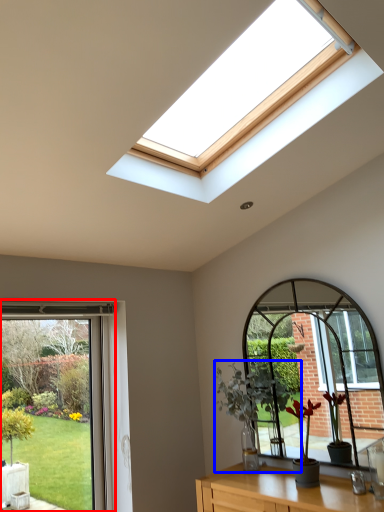
Question: Which object is closer to the camera taking this photo, window (highlighted by a red box) or houseplant (highlighted by a blue box)?

Choices:
 (A) window
 (B) houseplant

Answer: (A)